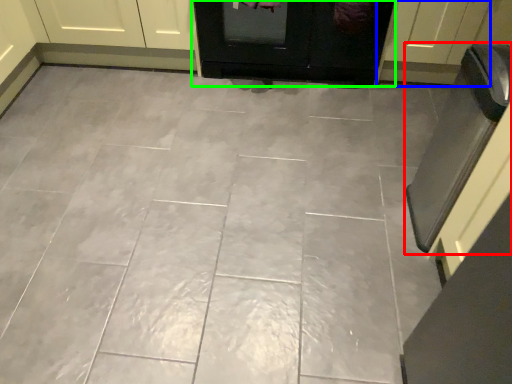
Question: Based on their relative distances, which object is farther from oven (highlighted by a red box)? Choose from door (highlighted by a blue box) and door (highlighted by a green box).

Choices:
 (A) door
 (B) door

Answer: (B)